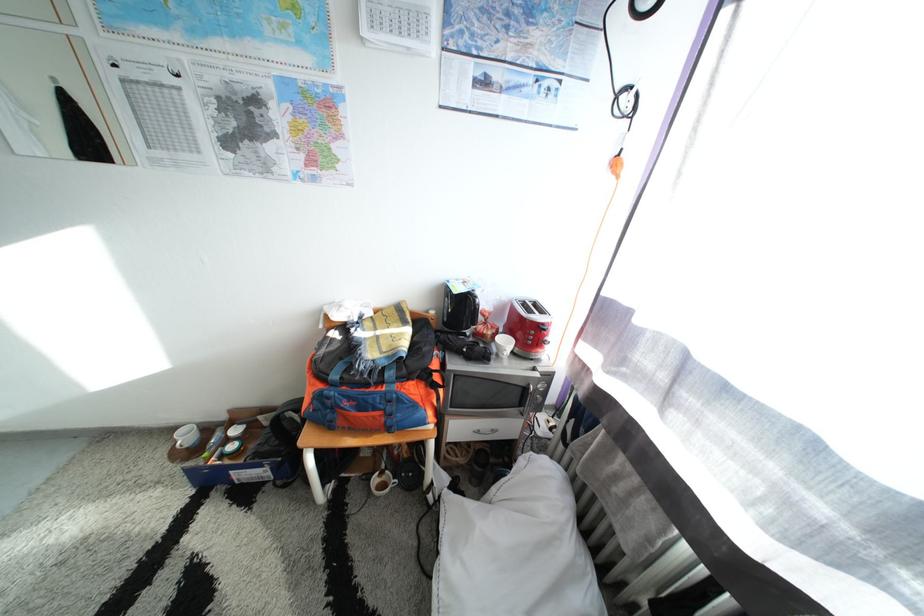
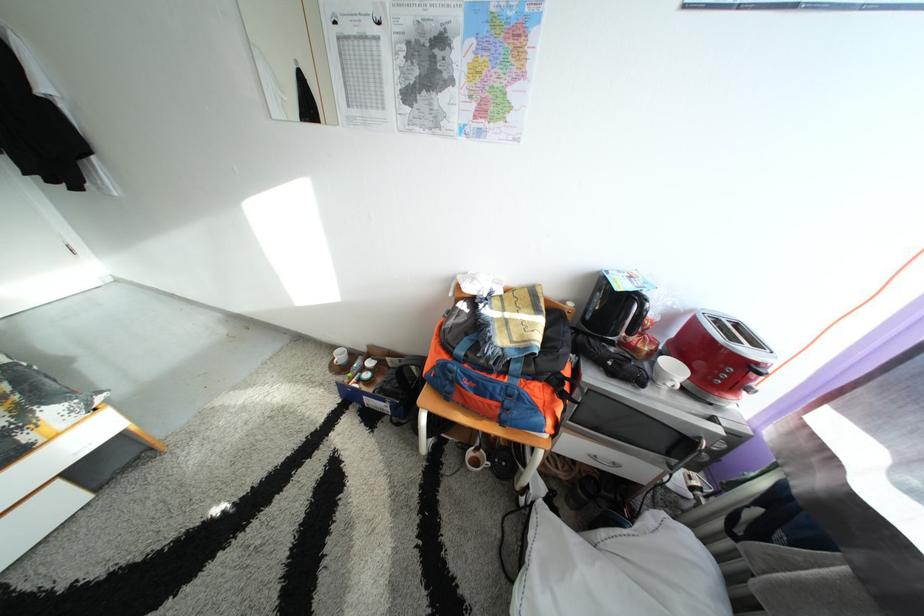
Find the pixel in the second image that matches pixel 552 331 in the first image.

(767, 370)